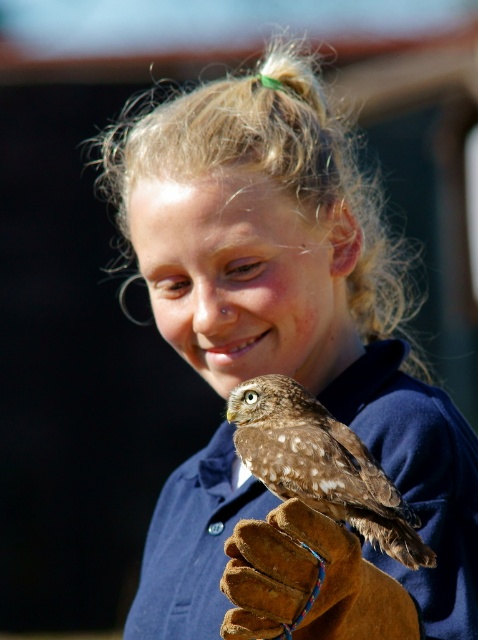
Which is more to the left, brown leather glove at lower center or brown speckled owl at lower center?

brown leather glove at lower center

Does brown leather glove at lower center have a greater height compared to brown speckled owl at lower center?

No, brown leather glove at lower center is not taller than brown speckled owl at lower center.

Which is behind, point (365, 632) or point (357, 452)?

Positioned behind is point (357, 452).

Where is `brown leather glove at lower center`? brown leather glove at lower center is located at coordinates (308, 582).